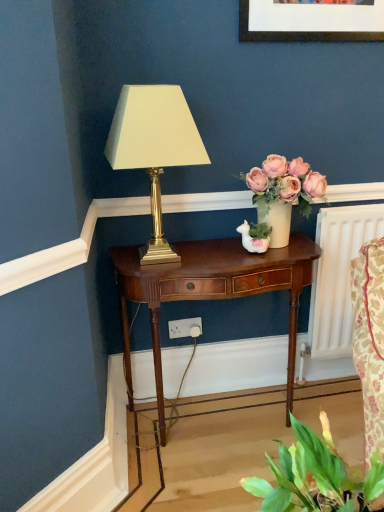
Question: Can you confirm if matte cream vase with pink roses at center is shorter than gold metallic lamp at center?

Choices:
 (A) no
 (B) yes

Answer: (B)

Question: Does matte cream vase with pink roses at center lie in front of gold metallic lamp at center?

Choices:
 (A) no
 (B) yes

Answer: (A)

Question: From a real-world perspective, is matte cream vase with pink roses at center physically below gold metallic lamp at center?

Choices:
 (A) yes
 (B) no

Answer: (A)

Question: Does matte cream vase with pink roses at center come behind gold metallic lamp at center?

Choices:
 (A) no
 (B) yes

Answer: (B)

Question: Is matte cream vase with pink roses at center aimed at gold metallic lamp at center?

Choices:
 (A) yes
 (B) no

Answer: (B)

Question: Does point (268, 269) appear closer or farther from the camera than point (271, 168)?

Choices:
 (A) closer
 (B) farther

Answer: (A)

Question: From a real-world perspective, is mahogany wood nightstand at center physically located above or below matte cream vase with pink roses at center?

Choices:
 (A) below
 (B) above

Answer: (A)

Question: Based on their sizes in the image, would you say mahogany wood nightstand at center is bigger or smaller than matte cream vase with pink roses at center?

Choices:
 (A) big
 (B) small

Answer: (A)

Question: Is mahogany wood nightstand at center spatially inside matte cream vase with pink roses at center, or outside of it?

Choices:
 (A) inside
 (B) outside

Answer: (B)

Question: Is point (152, 182) closer or farther from the camera than point (125, 254)?

Choices:
 (A) farther
 (B) closer

Answer: (B)

Question: Is gold metallic lamp at center taller or shorter than mahogany wood nightstand at center?

Choices:
 (A) tall
 (B) short

Answer: (B)

Question: From the image's perspective, is gold metallic lamp at center positioned above or below mahogany wood nightstand at center?

Choices:
 (A) below
 (B) above

Answer: (B)

Question: Which is correct: gold metallic lamp at center is inside mahogany wood nightstand at center, or outside of it?

Choices:
 (A) outside
 (B) inside

Answer: (A)

Question: Which is correct: matte cream vase with pink roses at center is inside gold metallic lamp at center, or outside of it?

Choices:
 (A) inside
 (B) outside

Answer: (B)

Question: From the image's perspective, is matte cream vase with pink roses at center above or below gold metallic lamp at center?

Choices:
 (A) above
 (B) below

Answer: (B)